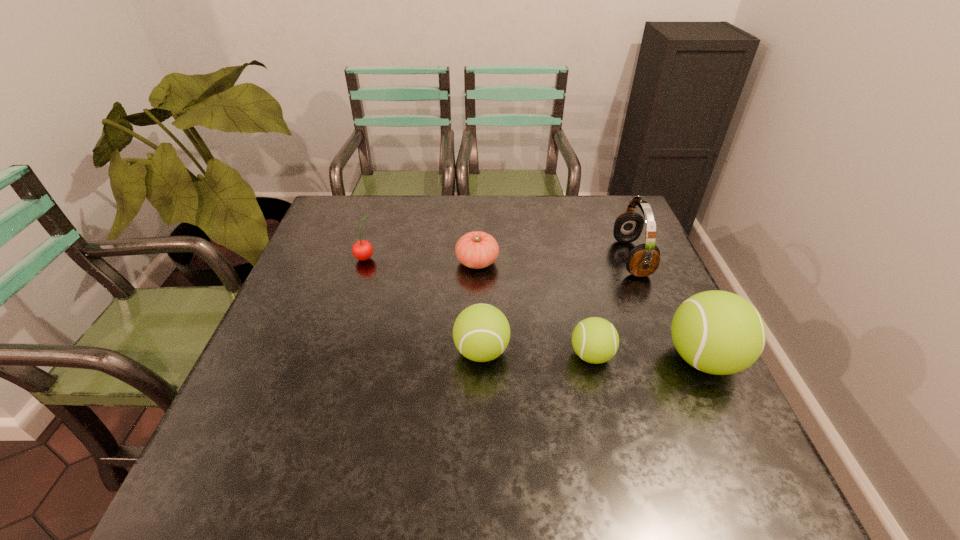
At what (x,y) coordinates should I click in order to perform the action: click on free space at the far edge. Please return your answer as a coordinate pair (x, y). Looking at the image, I should click on (415, 203).

Locate an element on the screen. The width and height of the screenshot is (960, 540). vacant area at the near edge of the desktop is located at coordinates (534, 432).

At what (x,y) coordinates should I click in order to perform the action: click on free space at the left edge of the desktop. Please return your answer as a coordinate pair (x, y). The height and width of the screenshot is (540, 960). Looking at the image, I should click on (332, 330).

Locate an element on the screen. free space at the right edge of the desktop is located at coordinates (634, 296).

You are a GUI agent. You are given a task and a screenshot of the screen. Output one action in this format:
    pyautogui.click(x=<x>, y=<y>)
    Task: Click on the vacant space at the far left corner of the desktop
    The height and width of the screenshot is (540, 960).
    Given the screenshot: What is the action you would take?
    pyautogui.click(x=355, y=224)

The height and width of the screenshot is (540, 960). Identify the location of vacant space at the near left corner of the desktop. pos(233,421).

In the image, there is a desktop. At what (x,y) coordinates should I click in order to perform the action: click on vacant space at the far right corner. Please return your answer as a coordinate pair (x, y). The height and width of the screenshot is (540, 960). Looking at the image, I should click on (608, 237).

The width and height of the screenshot is (960, 540). I want to click on vacant region between the headset and the leftmost object, so click(498, 258).

Find the location of a particular element. The width and height of the screenshot is (960, 540). free space between the third object from right to left and the leftmost tennis ball is located at coordinates (537, 353).

I want to click on free space between the shortest tennis ball and the tallest tennis ball, so click(647, 357).